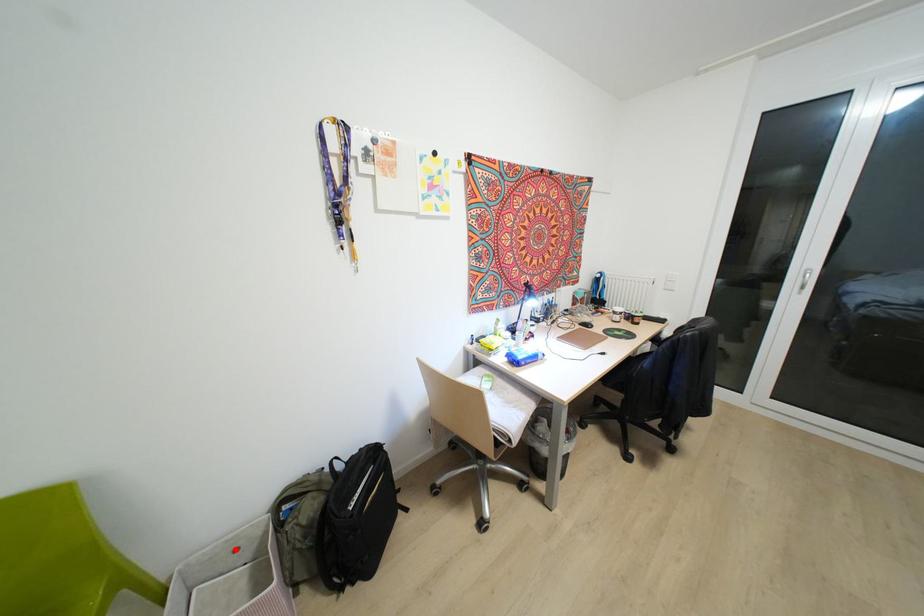
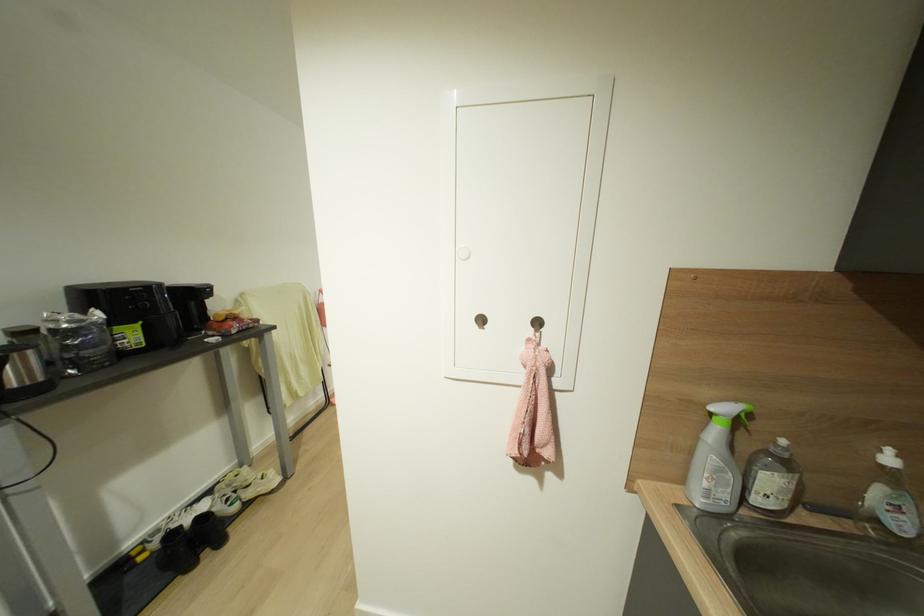
Question: I am providing you with two images of the same scene from different viewpoints. A red point is marked on the first image. Can you still see the location of the red point in image 2?

Choices:
 (A) Yes
 (B) No

Answer: (B)